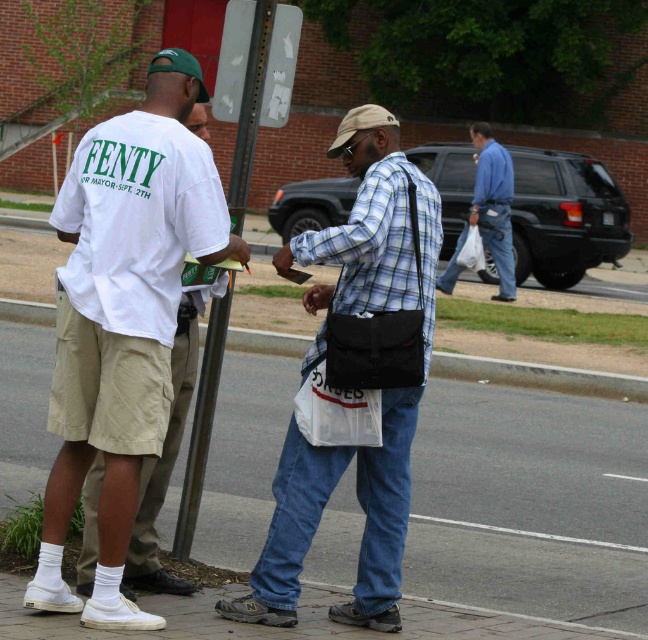
Question: Estimate the real-world distances between objects in this image. Which object is closer to the white cotton t-shirt at center?

Choices:
 (A) plaid cotton shirt at center
 (B) smooth asphalt sidewalk at center

Answer: (A)

Question: Is white cotton t-shirt at center closer to camera compared to blue cotton shirt at center?

Choices:
 (A) no
 (B) yes

Answer: (B)

Question: Estimate the real-world distances between objects in this image. Which object is farther from the white cotton t-shirt at center?

Choices:
 (A) plaid cotton shirt at center
 (B) blue cotton shirt at center

Answer: (B)

Question: Can you confirm if smooth asphalt sidewalk at center is positioned to the right of blue cotton shirt at center?

Choices:
 (A) no
 (B) yes

Answer: (A)

Question: Based on their relative distances, which object is nearer to the white cotton t-shirt at center?

Choices:
 (A) blue cotton shirt at center
 (B) plaid cotton shirt at center
 (C) smooth asphalt sidewalk at center

Answer: (B)

Question: Is white cotton t-shirt at center below plaid cotton shirt at center?

Choices:
 (A) yes
 (B) no

Answer: (B)